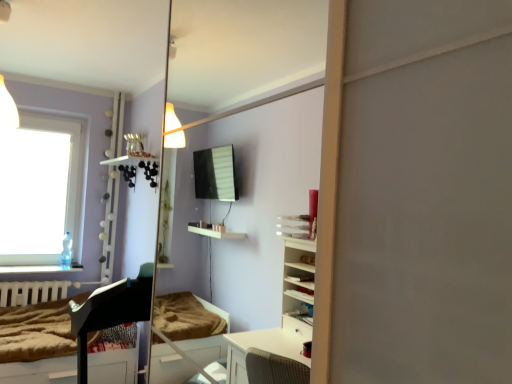
Question: Is brown textured mattress at lower left far away from black glossy piano at lower left?

Choices:
 (A) yes
 (B) no

Answer: (B)

Question: Is brown textured mattress at lower left next to black glossy piano at lower left?

Choices:
 (A) no
 (B) yes

Answer: (A)

Question: Is brown textured mattress at lower left further to camera compared to black glossy piano at lower left?

Choices:
 (A) no
 (B) yes

Answer: (B)

Question: From the image's perspective, does brown textured mattress at lower left appear lower than black glossy piano at lower left?

Choices:
 (A) yes
 (B) no

Answer: (B)

Question: Is black glossy piano at lower left completely or partially inside brown textured mattress at lower left?

Choices:
 (A) no
 (B) yes

Answer: (B)

Question: Can you confirm if brown textured mattress at lower left is shorter than black glossy piano at lower left?

Choices:
 (A) no
 (B) yes

Answer: (B)

Question: Is black glossy piano at lower left next to white matte radiator at lower left and touching it?

Choices:
 (A) no
 (B) yes

Answer: (A)

Question: From a real-world perspective, is black glossy piano at lower left on white matte radiator at lower left?

Choices:
 (A) yes
 (B) no

Answer: (B)

Question: From a real-world perspective, is black glossy piano at lower left below white matte radiator at lower left?

Choices:
 (A) no
 (B) yes

Answer: (B)

Question: Can you confirm if black glossy piano at lower left is positioned to the right of white matte radiator at lower left?

Choices:
 (A) no
 (B) yes

Answer: (B)

Question: From the image's perspective, is black glossy piano at lower left located above white matte radiator at lower left?

Choices:
 (A) yes
 (B) no

Answer: (B)

Question: Considering the relative positions of black glossy piano at lower left and white matte radiator at lower left in the image provided, is black glossy piano at lower left to the left of white matte radiator at lower left from the viewer's perspective?

Choices:
 (A) no
 (B) yes

Answer: (A)

Question: Does clear glass window at upper left appear on the left side of brown textured mattress at lower left?

Choices:
 (A) no
 (B) yes

Answer: (B)